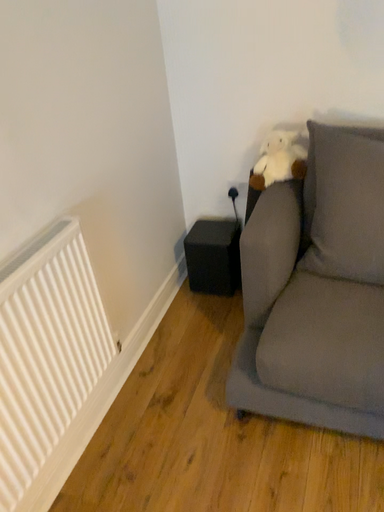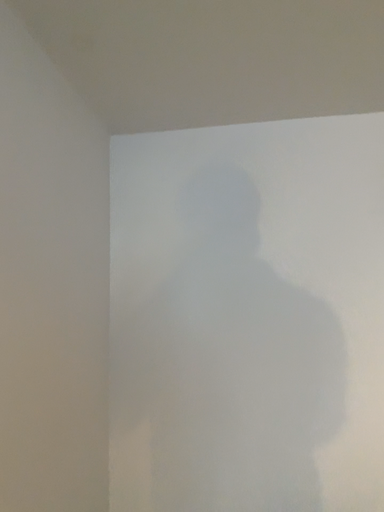
Question: How did the camera likely rotate when shooting the video?

Choices:
 (A) rotated left
 (B) rotated right

Answer: (B)